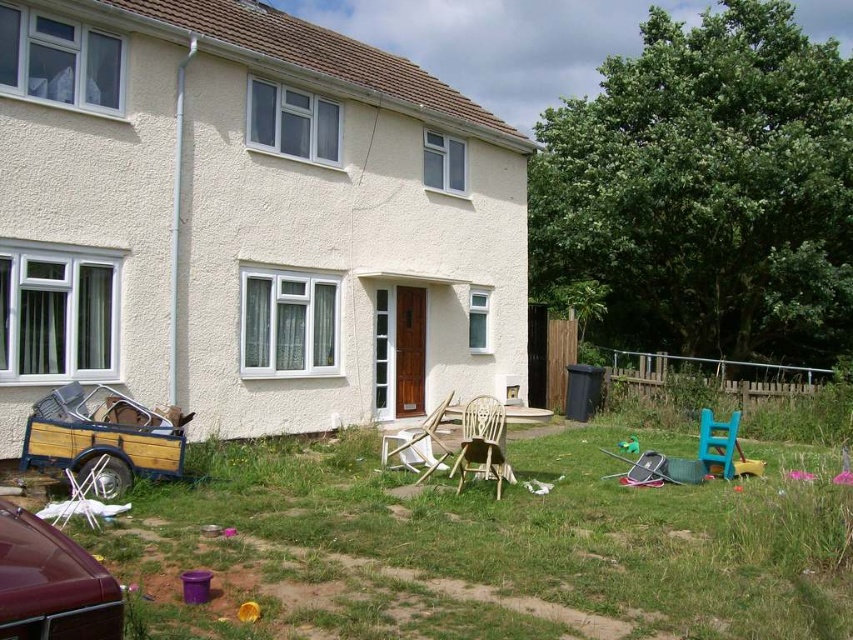
You are a delivery person trying to park your delivery van in the driveway of the house. You see a shiny maroon car at lower left and a blue plastic chair at lower right. Which object is blocking the driveway more towards the front?

The shiny maroon car at lower left is positioned over the blue plastic chair at lower right, meaning it is closer to the front of the driveway and thus blocking it more towards the front.